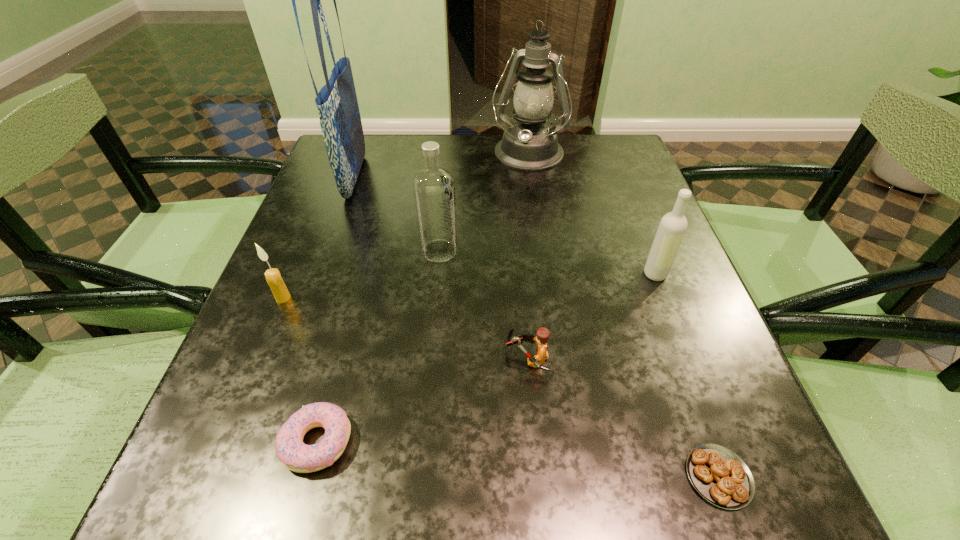
Where is `vacant position at the near left corner of the desktop`? The image size is (960, 540). vacant position at the near left corner of the desktop is located at coordinates (243, 518).

I want to click on empty space that is in between the seventh object from right to left and the second shortest object, so click(336, 309).

Image resolution: width=960 pixels, height=540 pixels. I want to click on vacant area that lies between the second shortest object and the shortest object, so click(517, 459).

Locate an element on the screen. The image size is (960, 540). free spot between the candle and the second tallest object is located at coordinates (405, 227).

Find the location of a particular element. Image resolution: width=960 pixels, height=540 pixels. free point between the seventh tallest object and the second object from left to right is located at coordinates (336, 309).

Identify the location of vacant point located between the doughnut and the left vodka. The height and width of the screenshot is (540, 960). (378, 346).

At what (x,y) coordinates should I click in order to perform the action: click on free space between the nearer vodka and the shortest object. Please return your answer as a coordinate pair (x, y). Looking at the image, I should click on (686, 375).

This screenshot has width=960, height=540. I want to click on free space between the candle and the oil lamp, so click(405, 227).

The width and height of the screenshot is (960, 540). I want to click on empty location between the shorter vodka and the pastry, so click(686, 375).

Identify the location of free space between the pastry and the tallest object. The width and height of the screenshot is (960, 540). (537, 327).